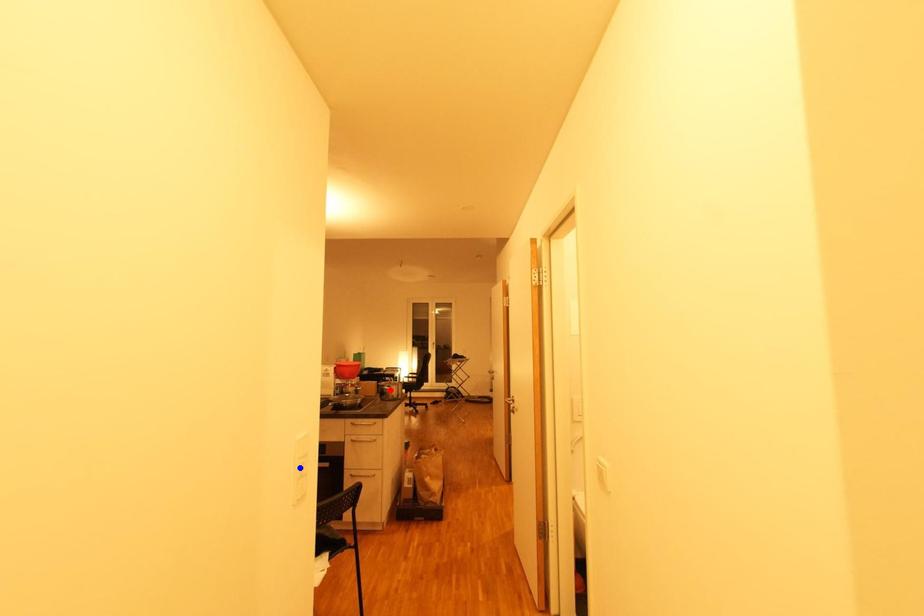
Question: In the image, two points are highlighted. Which point is nearer to the camera? Reply with the corresponding letter.

Choices:
 (A) blue point
 (B) red point

Answer: (A)